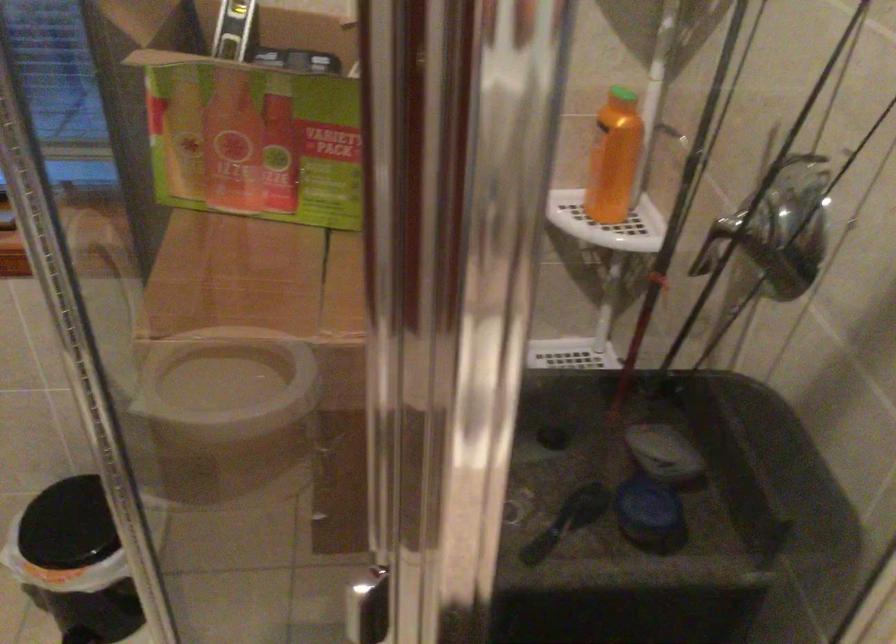
Find the location of `black trash can lid`. black trash can lid is located at coordinates (67, 525).